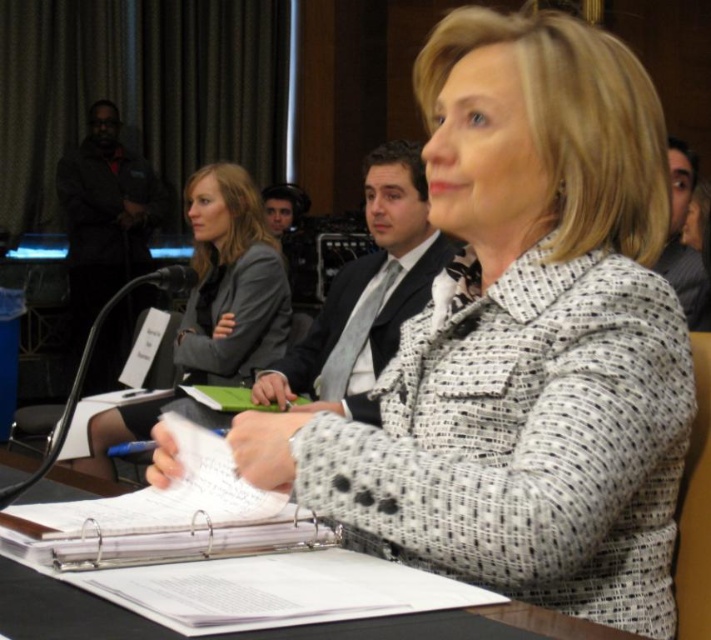
Is black paper at center bigger than black textured suit at center?

No.

Between point (614, 637) and point (343, 301), which one is positioned in front?

Point (614, 637)

Between point (100, 605) and point (397, 321), which one is positioned behind?

The point (397, 321) is behind.

Locate an element on the screen. black paper at center is located at coordinates (449, 627).

Can you confirm if white textured blazer at center is thinner than black paper at center?

Yes.

You are a GUI agent. You are given a task and a screenshot of the screen. Output one action in this format:
    pyautogui.click(x=<x>, y=<y>)
    Task: Click on the white textured blazer at center
    This screenshot has height=640, width=711.
    Given the screenshot: What is the action you would take?
    pyautogui.click(x=523, y=340)

Find the location of a particular element. This screenshot has width=711, height=640. white textured blazer at center is located at coordinates (523, 340).

Is gray fabric jacket at upper left closer to camera compared to black paper at center?

No, gray fabric jacket at upper left is further to the viewer.

Between gray fabric jacket at upper left and black paper at center, which one has more height?

gray fabric jacket at upper left

Identify the location of gray fabric jacket at upper left. This screenshot has height=640, width=711. pos(230,282).